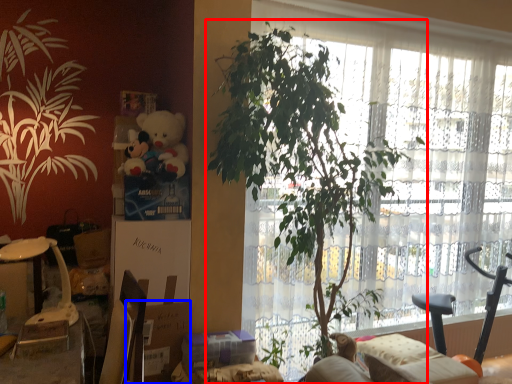
Question: Among these objects, which one is nearest to the camera, houseplant (highlighted by a red box) or cardboard box (highlighted by a blue box)?

Choices:
 (A) houseplant
 (B) cardboard box

Answer: (A)